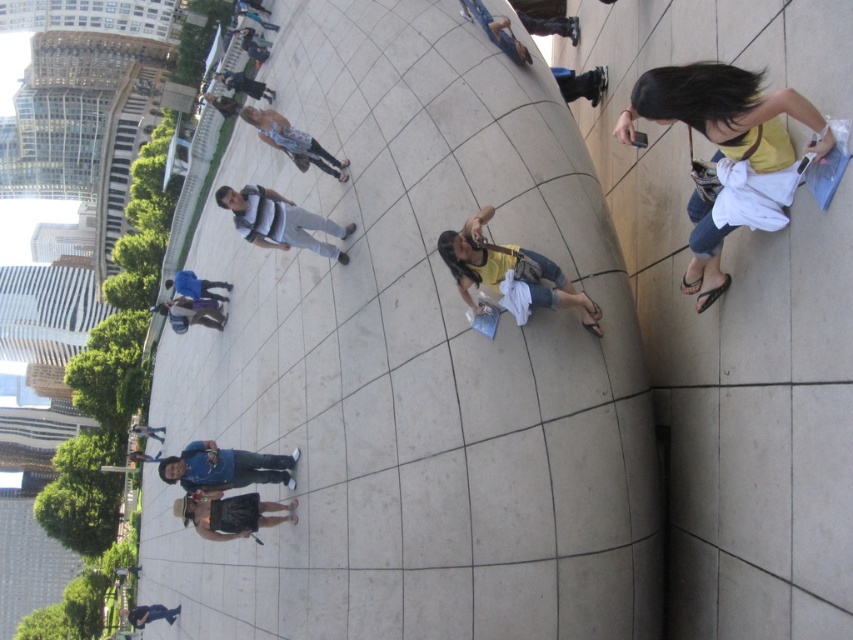
Is yellow cotton shirt at right smaller than brown leather hat at lower center?

No, yellow cotton shirt at right is not smaller than brown leather hat at lower center.

Does yellow cotton shirt at right appear on the right side of brown leather hat at lower center?

Correct, you'll find yellow cotton shirt at right to the right of brown leather hat at lower center.

What do you see at coordinates (728, 156) in the screenshot? This screenshot has width=853, height=640. I see `yellow cotton shirt at right` at bounding box center [728, 156].

Locate an element on the screen. This screenshot has height=640, width=853. yellow cotton shirt at right is located at coordinates (728, 156).

The height and width of the screenshot is (640, 853). What are the coordinates of `yellow cotton shirt at right` in the screenshot? It's located at (728, 156).

Between point (729, 172) and point (218, 476), which one is positioned in front?

Point (729, 172)

Is point (720, 269) less distant than point (230, 449)?

Yes, it is.

Locate an element on the screen. The height and width of the screenshot is (640, 853). yellow cotton shirt at right is located at coordinates (728, 156).

Can you confirm if dark blue jeans at lower left is taller than blue denim jeans at upper center?

Yes.

Based on the photo, does dark blue jeans at lower left have a lesser width compared to blue denim jeans at upper center?

In fact, dark blue jeans at lower left might be wider than blue denim jeans at upper center.

Does point (154, 616) come farther from viewer compared to point (241, 10)?

No, (154, 616) is in front of (241, 10).

Find the location of a particular element. dark blue jeans at lower left is located at coordinates (149, 614).